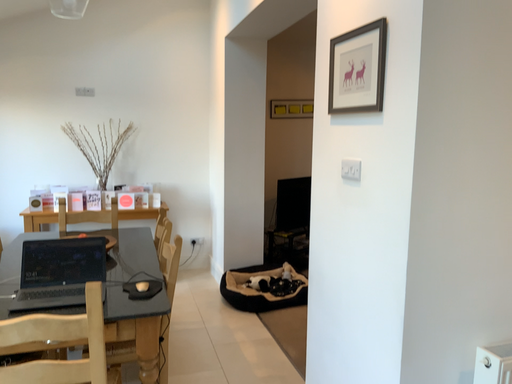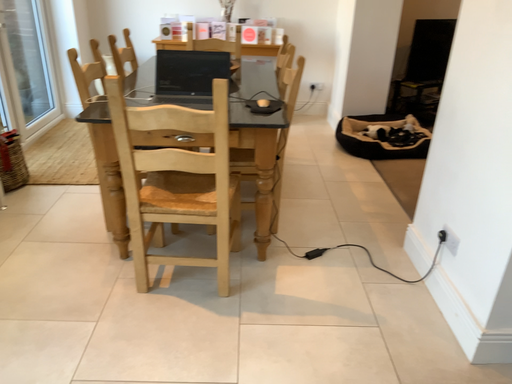
Question: How did the camera likely rotate when shooting the video?

Choices:
 (A) rotated upward
 (B) rotated downward

Answer: (B)